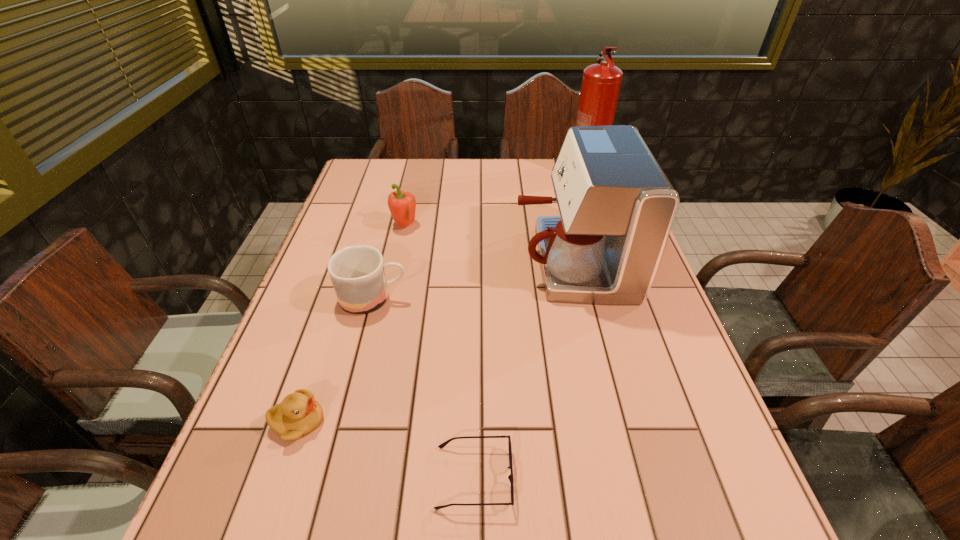
The image size is (960, 540). In order to click on coffee maker that is at the right edge in this screenshot , I will do `click(617, 207)`.

Identify the location of object that is at the far right corner. (601, 82).

Find the location of `free location at the far edge of the desktop`. free location at the far edge of the desktop is located at coordinates (475, 184).

The height and width of the screenshot is (540, 960). Identify the location of free space at the left edge. (322, 267).

The width and height of the screenshot is (960, 540). Identify the location of free space between the pepper and the duckling. (351, 324).

Identify the location of vacant area between the second shortest object and the pepper. Image resolution: width=960 pixels, height=540 pixels. tap(351, 324).

Find the location of a particular element. The height and width of the screenshot is (540, 960). vacant point located between the coffee maker and the duckling is located at coordinates (435, 341).

I want to click on free space between the coffee maker and the pepper, so click(x=489, y=244).

What are the coordinates of `free spot between the duckling and the fourth object from left to right` in the screenshot? It's located at (386, 450).

The height and width of the screenshot is (540, 960). In order to click on empty space between the pepper and the fifth tallest object in this screenshot , I will do `click(351, 324)`.